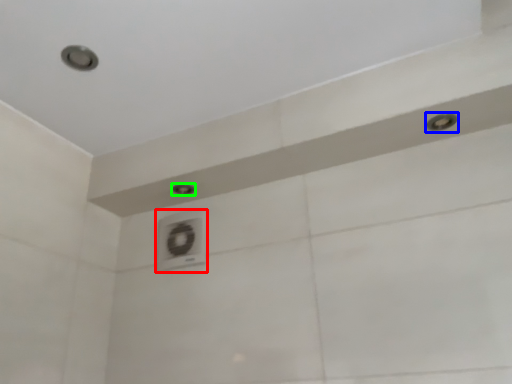
Question: Estimate the real-world distances between objects in this image. Which object is farther from air conditioner (highlighted by a red box), shower (highlighted by a blue box) or shower (highlighted by a green box)?

Choices:
 (A) shower
 (B) shower

Answer: (A)